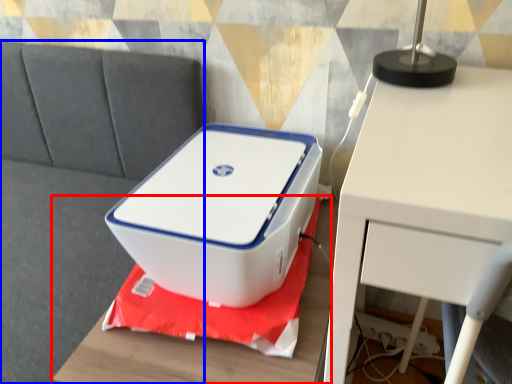
Question: Which object is further to the camera taking this photo, furniture (highlighted by a red box) or couch (highlighted by a blue box)?

Choices:
 (A) furniture
 (B) couch

Answer: (A)